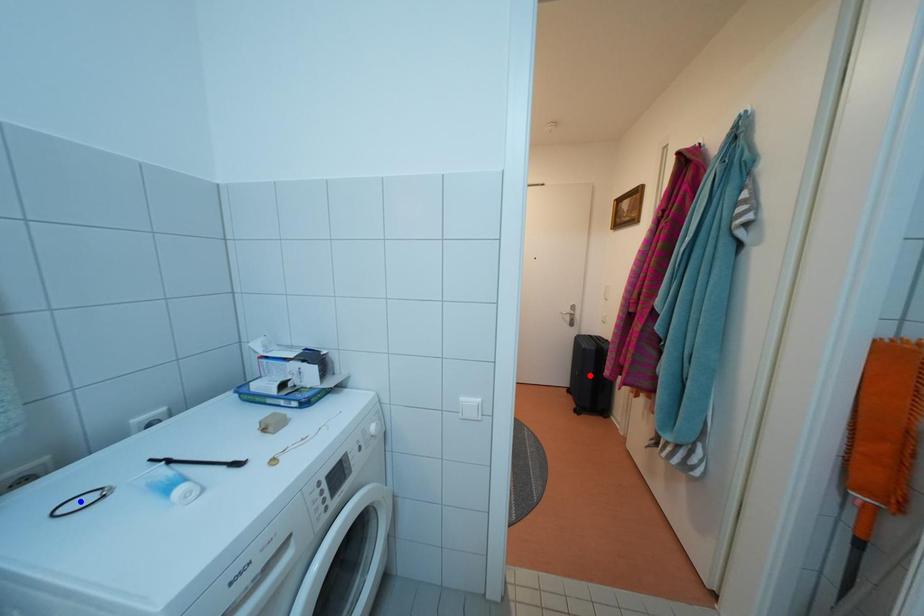
Question: In the image, two points are highlighted. Which point is nearer to the camera? Reply with the corresponding letter.

Choices:
 (A) blue point
 (B) red point

Answer: (A)